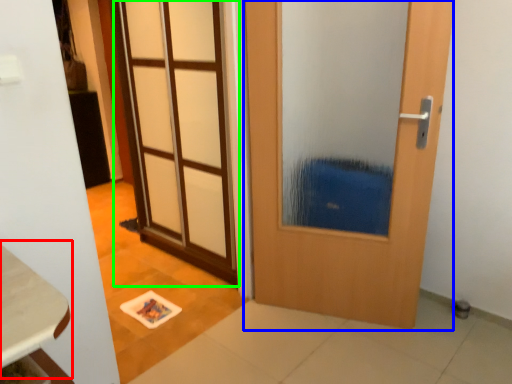
Question: Which is farther away from table (highlighted by a red box)? door (highlighted by a blue box) or door (highlighted by a green box)?

Choices:
 (A) door
 (B) door

Answer: (B)